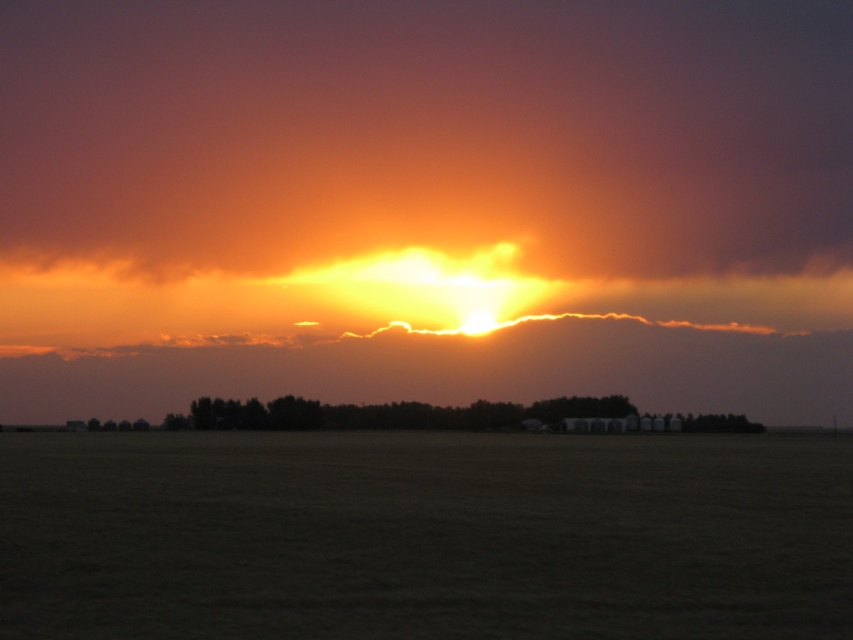
Question: Which of the following is the farthest from the observer?

Choices:
 (A) (527, 294)
 (B) (74, 461)

Answer: (A)

Question: Does dark brown grass at center lie behind cloudy orange sky at center?

Choices:
 (A) no
 (B) yes

Answer: (A)

Question: Which of the following is the farthest from the observer?

Choices:
 (A) cloudy orange sky at center
 (B) dark brown grass at center

Answer: (A)

Question: Is dark brown grass at center positioned in front of cloudy orange sky at center?

Choices:
 (A) no
 (B) yes

Answer: (B)

Question: Does dark brown grass at center appear over cloudy orange sky at center?

Choices:
 (A) yes
 (B) no

Answer: (B)